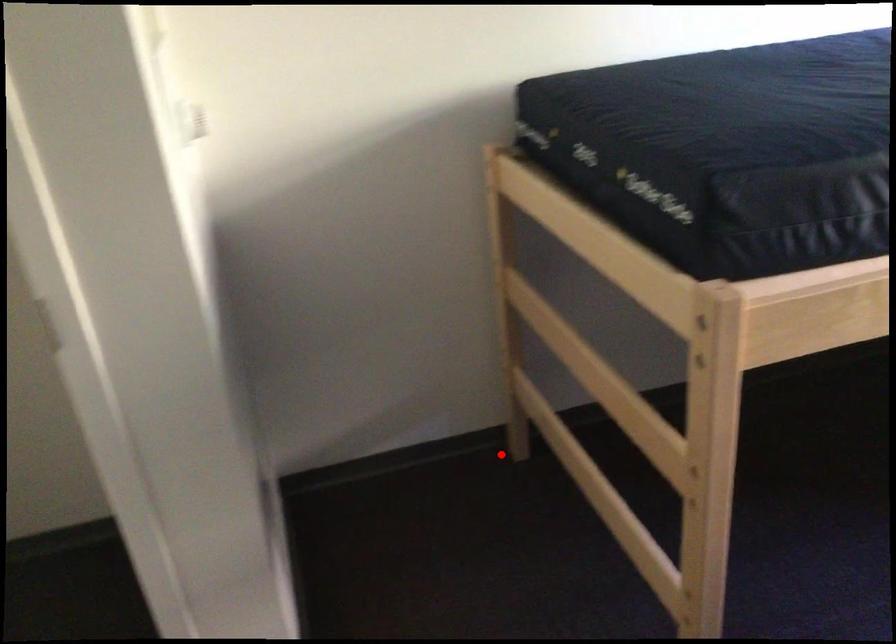
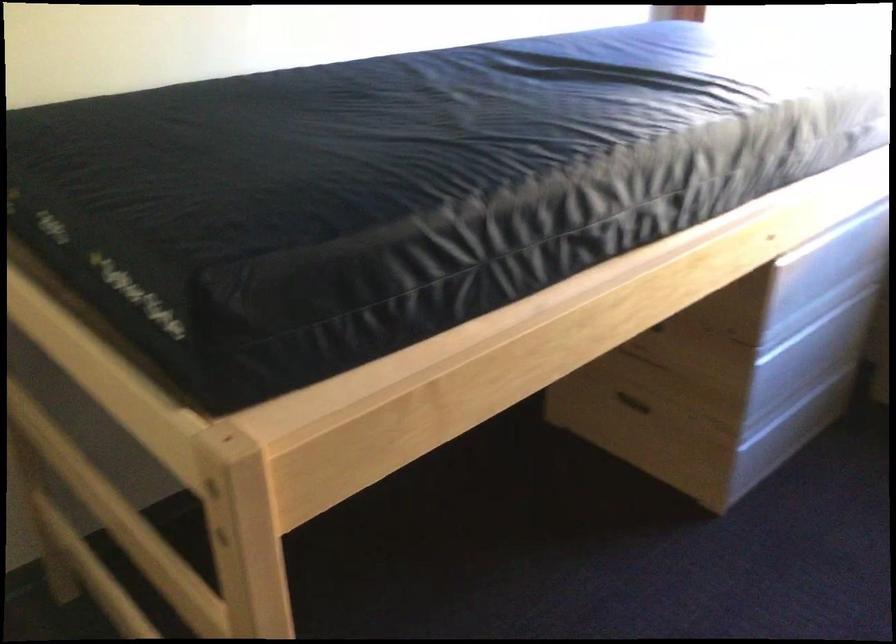
Question: I am providing you with two images of the same scene from different viewpoints. Given a red point in image1, look at the same physical point in image2. Is it:

Choices:
 (A) Closer to the viewpoint
 (B) Farther from the viewpoint

Answer: (A)